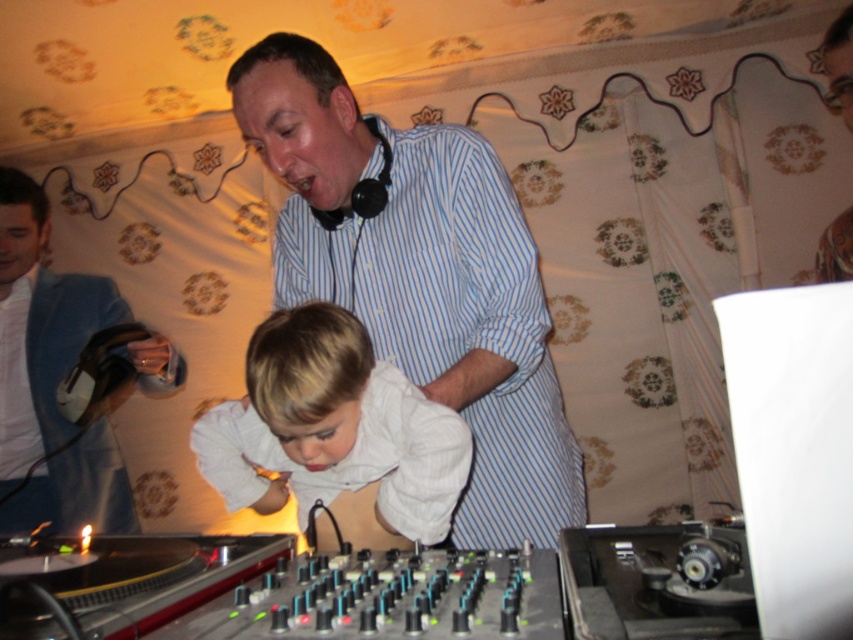
Measure the distance between blue striped shirt at center and camera.

blue striped shirt at center and camera are 3.36 feet apart.

Is point (479, 456) farther from camera compared to point (445, 422)?

Yes, point (479, 456) is farther from viewer.

In the scene shown: Who is more distant from viewer, (579, 467) or (430, 404)?

Point (579, 467)

The width and height of the screenshot is (853, 640). In order to click on blue striped shirt at center in this screenshot , I will do `click(421, 275)`.

Is white shirt at center shorter than blue fabric jacket at left?

Indeed, white shirt at center has a lesser height compared to blue fabric jacket at left.

Can you confirm if white shirt at center is thinner than blue fabric jacket at left?

No.

Between point (453, 497) and point (3, 224), which one is positioned in front?

Positioned in front is point (453, 497).

Locate an element on the screen. white shirt at center is located at coordinates (334, 428).

Is blue striped shirt at center behind blue fabric jacket at left?

No.

Who is higher up, blue striped shirt at center or blue fabric jacket at left?

Positioned higher is blue striped shirt at center.

Between point (412, 362) and point (41, 246), which one is positioned behind?

Point (41, 246)

The height and width of the screenshot is (640, 853). I want to click on blue striped shirt at center, so click(x=421, y=275).